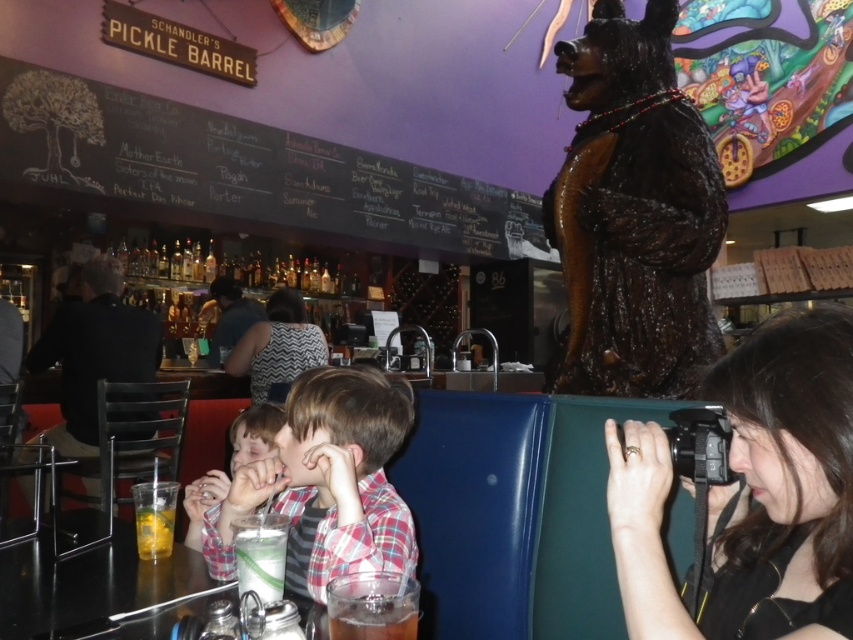
Between smooth skin child at center and clear glass cup at center, which one has less height?

clear glass cup at center

Can you confirm if smooth skin child at center is taller than clear glass cup at center?

Correct, smooth skin child at center is much taller as clear glass cup at center.

Locate an element on the screen. This screenshot has width=853, height=640. smooth skin child at center is located at coordinates (254, 433).

Between point (830, 342) and point (254, 445), which one is positioned behind?

The point (254, 445) is behind.

Is the position of black fabric camera at right less distant than that of smooth skin child at center?

Yes, it is.

Where is `black fabric camera at right`? The width and height of the screenshot is (853, 640). black fabric camera at right is located at coordinates (753, 492).

Which of these two, black fabric camera at right or clear glass cup at center, stands shorter?

Standing shorter between the two is clear glass cup at center.

The height and width of the screenshot is (640, 853). What are the coordinates of `black fabric camera at right` in the screenshot? It's located at (753, 492).